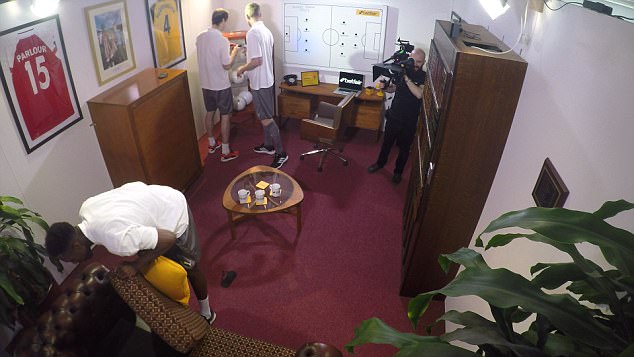
Where is `whiteboard`? The image size is (634, 357). whiteboard is located at coordinates (333, 31).